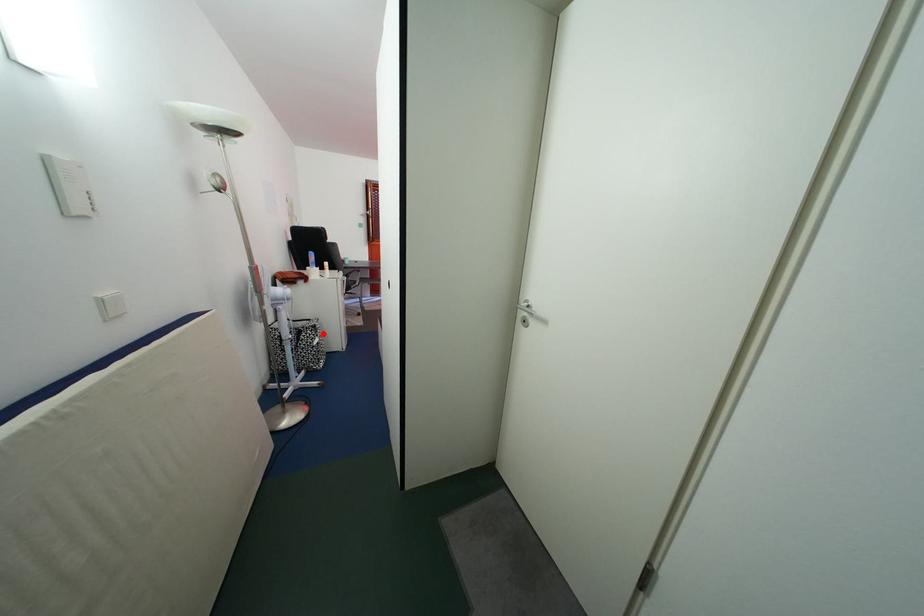
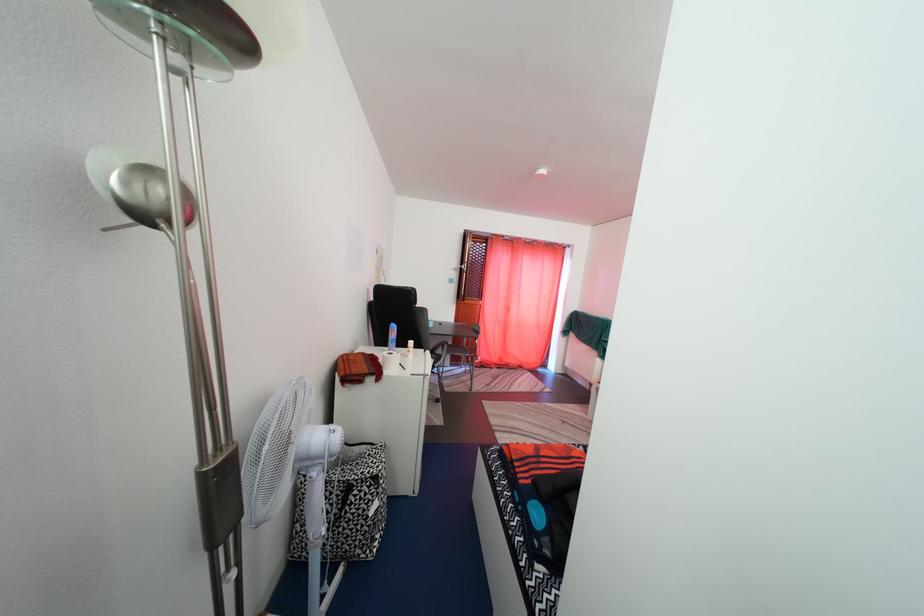
Question: I am providing you with two images of the same scene from different viewpoints. Image1 has a red point marked. In image2, the corresponding 3D location appears at what relative position? Reply with the corresponding letter.

Choices:
 (A) Closer
 (B) Farther

Answer: (B)